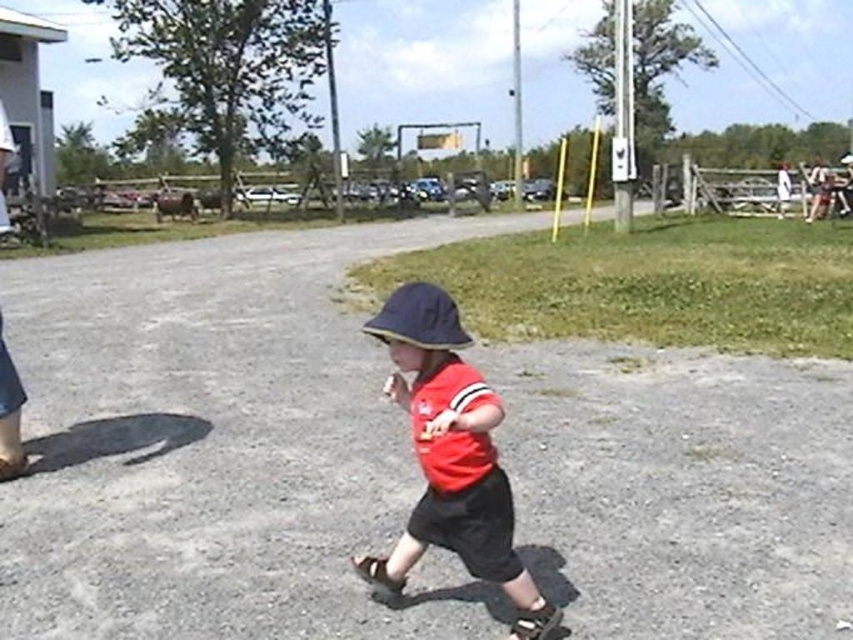
You are trying to determine the position of the gray gravel road at center and the navy blue fabric baseball hat at center. Which object is located lower in the image?

The gray gravel road at center is located lower than the navy blue fabric baseball hat at center in the image.